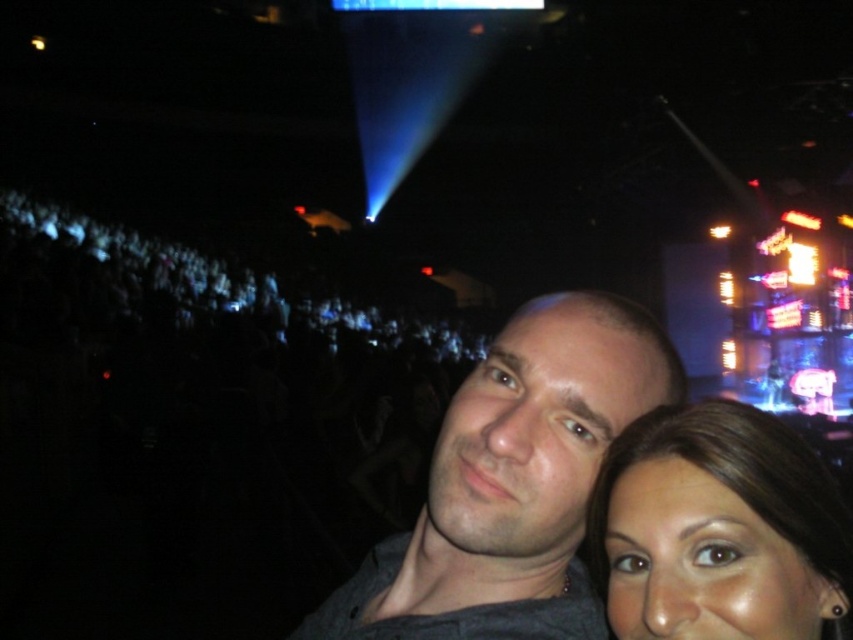
Consider the image. Is dark gray shirt at center below brown hair at lower right?

Yes, dark gray shirt at center is below brown hair at lower right.

Is dark gray shirt at center to the right of brown hair at lower right from the viewer's perspective?

Incorrect, dark gray shirt at center is not on the right side of brown hair at lower right.

Which is behind, point (544, 420) or point (849, 560)?

Point (544, 420)

The width and height of the screenshot is (853, 640). What are the coordinates of `dark gray shirt at center` in the screenshot? It's located at (514, 483).